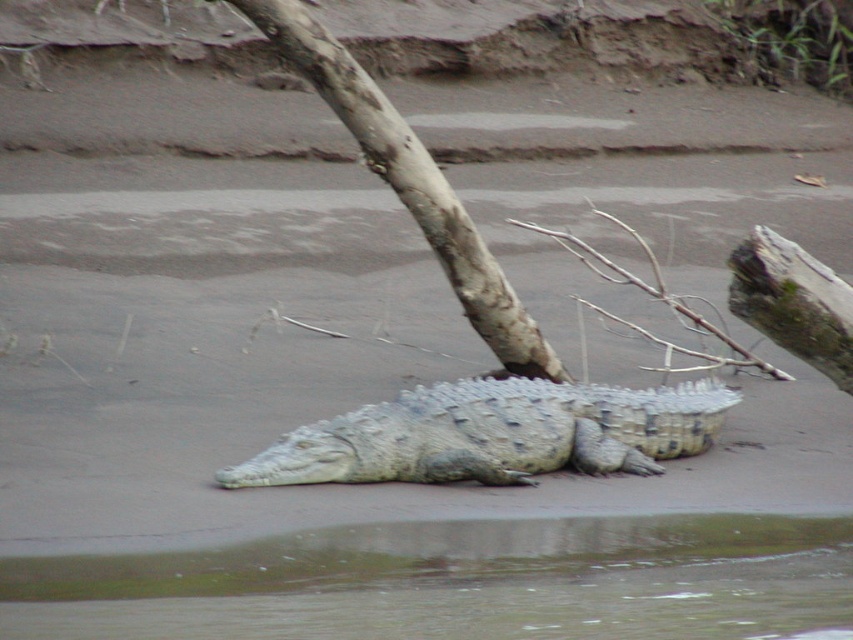
Does sandy textured crocodile at center have a greater width compared to smooth gray bark at center?

Indeed, sandy textured crocodile at center has a greater width compared to smooth gray bark at center.

Is point (471, 384) positioned behind point (451, 237)?

No, it is in front of (451, 237).

Identify the location of sandy textured crocodile at center. The height and width of the screenshot is (640, 853). (494, 435).

Between greenish water at lower center and brown rough branch at center right, which one has less height?

greenish water at lower center

Is greenish water at lower center to the right of brown rough branch at center right from the viewer's perspective?

In fact, greenish water at lower center is to the left of brown rough branch at center right.

At what (x,y) coordinates should I click in order to perform the action: click on greenish water at lower center. Please return your answer as a coordinate pair (x, y). This screenshot has width=853, height=640. Looking at the image, I should click on (457, 582).

Image resolution: width=853 pixels, height=640 pixels. What are the coordinates of `greenish water at lower center` in the screenshot? It's located at (457, 582).

Does smooth gray bark at center appear under brown rough branch at center right?

Actually, smooth gray bark at center is above brown rough branch at center right.

Can you confirm if smooth gray bark at center is positioned to the left of brown rough branch at center right?

Indeed, smooth gray bark at center is positioned on the left side of brown rough branch at center right.

Measure the distance between smooth gray bark at center and camera.

smooth gray bark at center and camera are 27.45 feet apart from each other.

Where is `smooth gray bark at center`? The height and width of the screenshot is (640, 853). smooth gray bark at center is located at coordinates (410, 186).